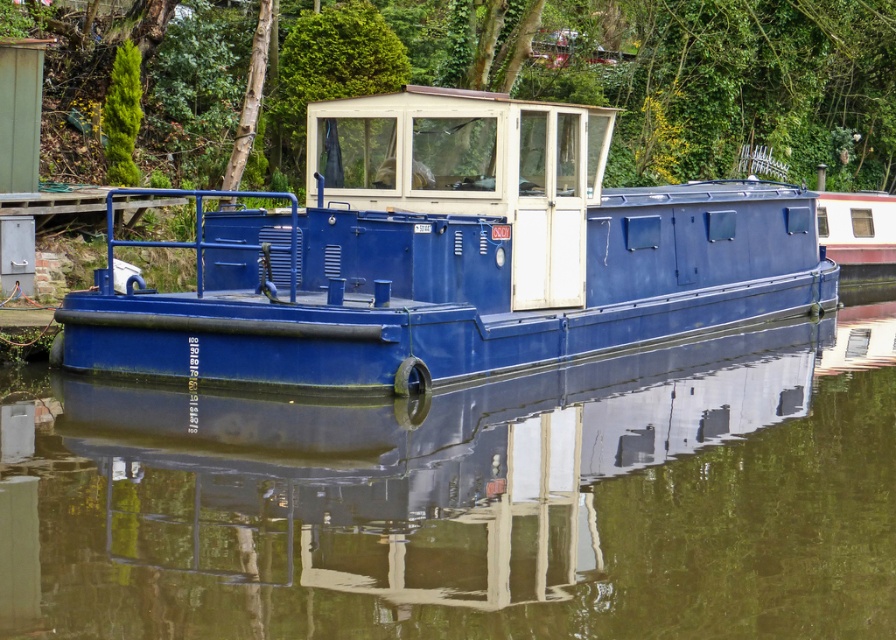
Is glossy blue boat at center shorter than matte blue boat at center?

Yes, glossy blue boat at center is shorter than matte blue boat at center.

Does glossy blue boat at center appear under matte blue boat at center?

Correct, glossy blue boat at center is located below matte blue boat at center.

Between point (510, 628) and point (748, 209), which one is positioned in front?

Positioned in front is point (510, 628).

Where is `glossy blue boat at center`? glossy blue boat at center is located at coordinates (468, 500).

Where is `glossy blue boat at center`? This screenshot has width=896, height=640. glossy blue boat at center is located at coordinates (468, 500).

The width and height of the screenshot is (896, 640). Find the location of `glossy blue boat at center`. glossy blue boat at center is located at coordinates (468, 500).

From the picture: Can you confirm if matte blue boat at center is positioned below green leafy tree at upper center?

Indeed, matte blue boat at center is positioned under green leafy tree at upper center.

Which of these two, matte blue boat at center or green leafy tree at upper center, stands taller?

With more height is green leafy tree at upper center.

Is point (274, 364) positioned in front of point (889, 180)?

Yes.

The height and width of the screenshot is (640, 896). I want to click on matte blue boat at center, so click(x=453, y=257).